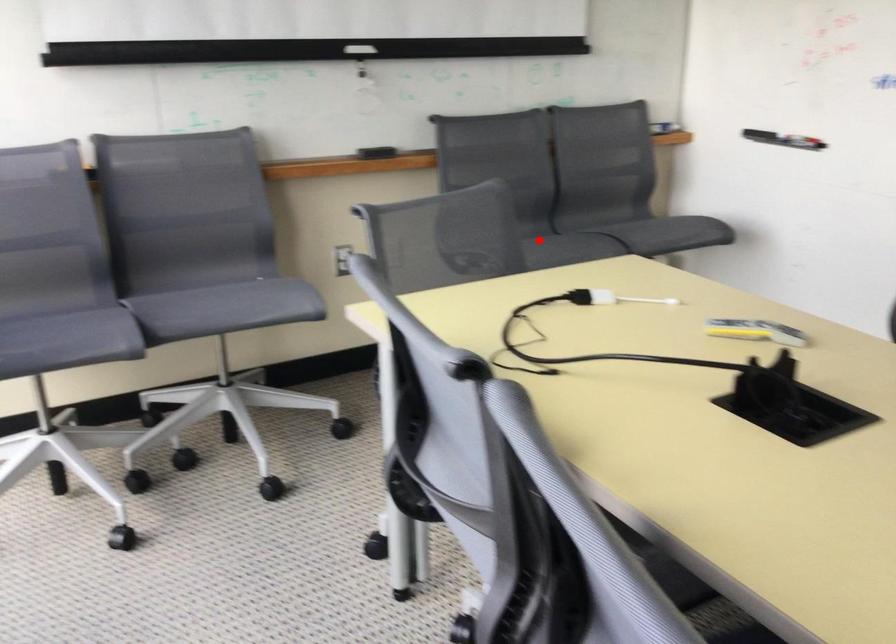
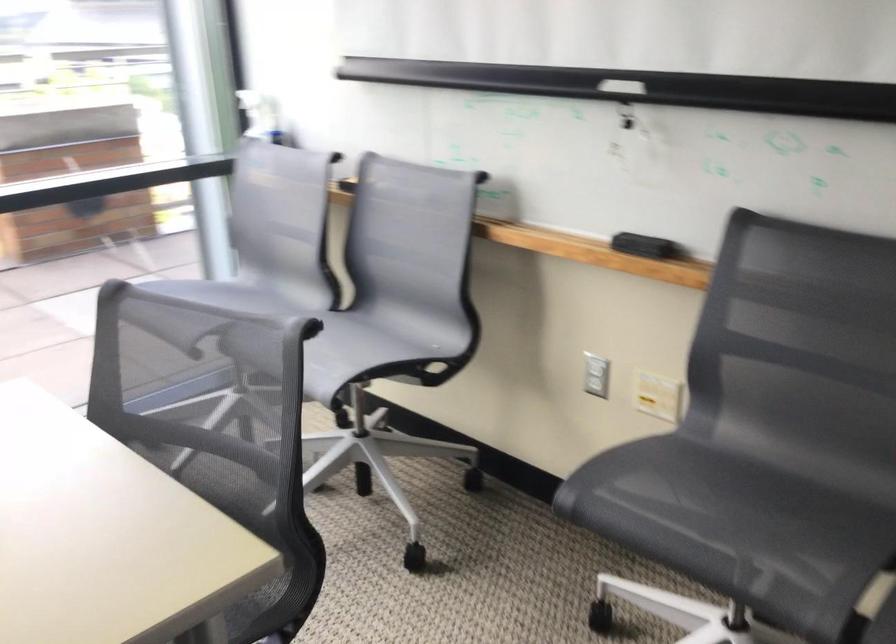
Question: I am providing you with two images of the same scene from different viewpoints. Image1 has a red point marked. In image2, the corresponding 3D location appears at what relative position? Reply with the corresponding letter.

Choices:
 (A) Closer
 (B) Farther

Answer: (A)